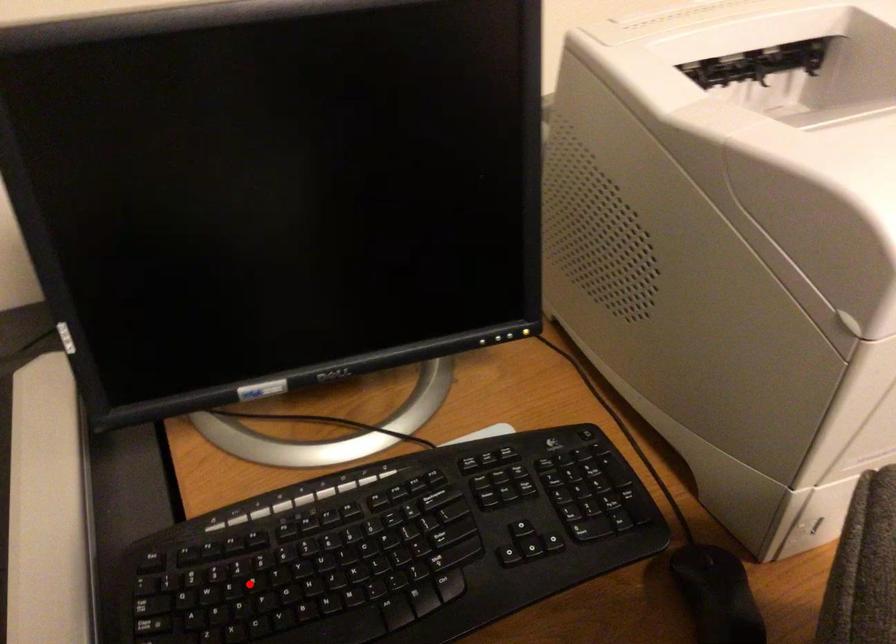
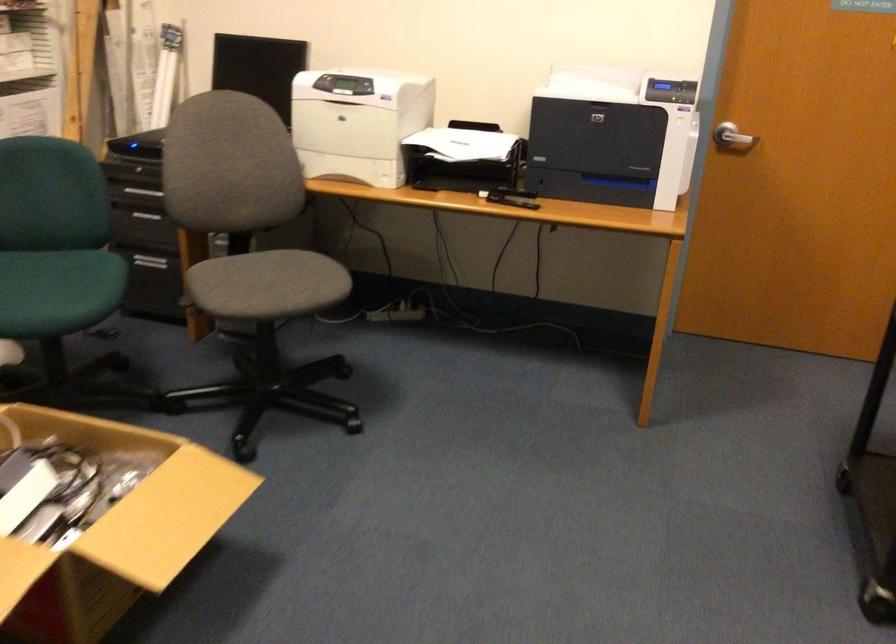
Question: I am providing you with two images of the same scene from different viewpoints. A red point is marked on the first image. At the location where the point appears in image 1, is it still visible in image 2?

Choices:
 (A) Yes
 (B) No

Answer: (B)